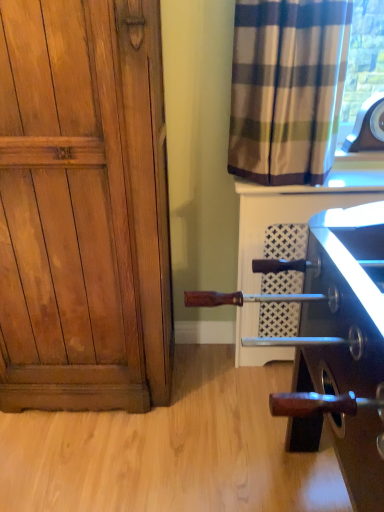
Question: Should I look upward or downward to see white textured tile at upper right?

Choices:
 (A) down
 (B) up

Answer: (B)

Question: From the image's perspective, does wooden paneling at left appear higher than plaid fabric curtain at upper right?

Choices:
 (A) no
 (B) yes

Answer: (A)

Question: Does wooden paneling at left turn towards plaid fabric curtain at upper right?

Choices:
 (A) no
 (B) yes

Answer: (A)

Question: From a real-world perspective, is wooden paneling at left beneath plaid fabric curtain at upper right?

Choices:
 (A) yes
 (B) no

Answer: (A)

Question: Is wooden paneling at left next to plaid fabric curtain at upper right?

Choices:
 (A) no
 (B) yes

Answer: (A)

Question: Is plaid fabric curtain at upper right located within wooden paneling at left?

Choices:
 (A) yes
 (B) no

Answer: (B)

Question: Considering the relative positions of wooden paneling at left and plaid fabric curtain at upper right in the image provided, is wooden paneling at left to the left of plaid fabric curtain at upper right from the viewer's perspective?

Choices:
 (A) yes
 (B) no

Answer: (A)

Question: Does white textured tile at upper right come behind wooden paneling at left?

Choices:
 (A) no
 (B) yes

Answer: (B)

Question: Considering the relative sizes of white textured tile at upper right and wooden paneling at left in the image provided, is white textured tile at upper right shorter than wooden paneling at left?

Choices:
 (A) yes
 (B) no

Answer: (A)

Question: Is white textured tile at upper right smaller than wooden paneling at left?

Choices:
 (A) no
 (B) yes

Answer: (B)

Question: From a real-world perspective, is white textured tile at upper right located higher than wooden paneling at left?

Choices:
 (A) no
 (B) yes

Answer: (B)

Question: Is white textured tile at upper right touching wooden paneling at left?

Choices:
 (A) no
 (B) yes

Answer: (A)

Question: Is wooden paneling at left a part of white textured tile at upper right?

Choices:
 (A) no
 (B) yes

Answer: (A)

Question: Does plaid fabric curtain at upper right touch white textured tile at upper right?

Choices:
 (A) no
 (B) yes

Answer: (A)